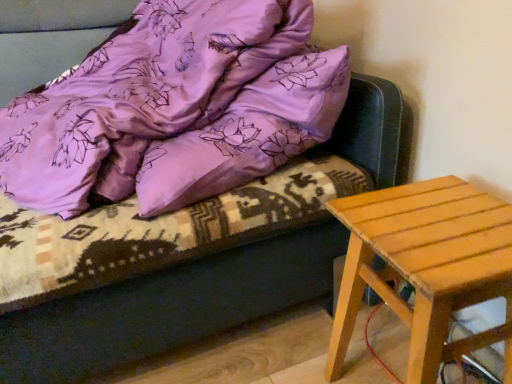
Identify the location of satin purple blanket at upper left. (139, 96).

Describe the element at coordinates (139, 96) in the screenshot. The image size is (512, 384). I see `satin purple blanket at upper left` at that location.

What is the approximate height of satin purple blanket at upper left?

It is 56.66 centimeters.

What is the approximate width of wooden stool at right?

14.02 inches.

Describe the element at coordinates (426, 267) in the screenshot. I see `wooden stool at right` at that location.

At what (x,y) coordinates should I click in order to perform the action: click on wooden stool at right. Please return your answer as a coordinate pair (x, y). This screenshot has width=512, height=384. Looking at the image, I should click on (426, 267).

The image size is (512, 384). What are the coordinates of `satin purple blanket at upper left` in the screenshot? It's located at (139, 96).

Is satin purple blanket at upper left at the right side of wooden stool at right?

No.

Is the depth of satin purple blanket at upper left less than that of wooden stool at right?

Yes, it is.

Is point (102, 175) closer to viewer compared to point (479, 268)?

No, (102, 175) is further to viewer.

From the image's perspective, which one is positioned higher, satin purple blanket at upper left or wooden stool at right?

satin purple blanket at upper left.

From a real-world perspective, which object stands above the other?

From a 3D spatial view, satin purple blanket at upper left is above.

Does satin purple blanket at upper left have a greater width compared to wooden stool at right?

Yes.

Is satin purple blanket at upper left taller or shorter than wooden stool at right?

Considering their sizes, satin purple blanket at upper left has more height than wooden stool at right.

Considering the relative sizes of satin purple blanket at upper left and wooden stool at right in the image provided, is satin purple blanket at upper left smaller than wooden stool at right?

Incorrect, satin purple blanket at upper left is not smaller in size than wooden stool at right.

Can wooden stool at right be found inside satin purple blanket at upper left?

No, wooden stool at right is not surrounded by satin purple blanket at upper left.

Does satin purple blanket at upper left touch wooden stool at right?

No, satin purple blanket at upper left is not in contact with wooden stool at right.

Is wooden stool at right at the back of satin purple blanket at upper left?

No, wooden stool at right is not at the back of satin purple blanket at upper left.

How many degrees apart are the facing directions of satin purple blanket at upper left and wooden stool at right?

The angular difference between satin purple blanket at upper left and wooden stool at right is 14.5 degrees.

Identify the location of stool on the right of satin purple blanket at upper left. (426, 267).

Is wooden stool at right to the left of satin purple blanket at upper left from the viewer's perspective?

No, wooden stool at right is not to the left of satin purple blanket at upper left.

Considering their positions, is wooden stool at right located in front of or behind satin purple blanket at upper left?

wooden stool at right is behind satin purple blanket at upper left.

Considering the points (435, 198) and (122, 124), which point is in front, point (435, 198) or point (122, 124)?

The point (435, 198) is closer to the camera.

From the image's perspective, is wooden stool at right above or below satin purple blanket at upper left?

Clearly, from the image's perspective, wooden stool at right is below satin purple blanket at upper left.

From a real-world perspective, is wooden stool at right above or below satin purple blanket at upper left?

wooden stool at right is below satin purple blanket at upper left.

Which of these two, wooden stool at right or satin purple blanket at upper left, is thinner?

wooden stool at right is thinner.

Who is taller, wooden stool at right or satin purple blanket at upper left?

With more height is satin purple blanket at upper left.

Is wooden stool at right smaller than satin purple blanket at upper left?

Yes, wooden stool at right is smaller than satin purple blanket at upper left.

Is wooden stool at right spatially inside satin purple blanket at upper left, or outside of it?

wooden stool at right is not enclosed by satin purple blanket at upper left.

Is wooden stool at right next to satin purple blanket at upper left and touching it?

No, wooden stool at right is not in contact with satin purple blanket at upper left.

Looking at this image, is wooden stool at right turned away from satin purple blanket at upper left?

No, wooden stool at right is not facing away from satin purple blanket at upper left.

Can you tell me how much wooden stool at right and satin purple blanket at upper left differ in facing direction?

The facing directions of wooden stool at right and satin purple blanket at upper left are 14.5 degrees apart.

Where is `stool that appears on the right of satin purple blanket at upper left`? stool that appears on the right of satin purple blanket at upper left is located at coordinates (426, 267).

Locate an element on the screen. blanket that is above the wooden stool at right (from a real-world perspective) is located at coordinates (139, 96).

Identify the location of blanket above the wooden stool at right (from the image's perspective). Image resolution: width=512 pixels, height=384 pixels. (139, 96).